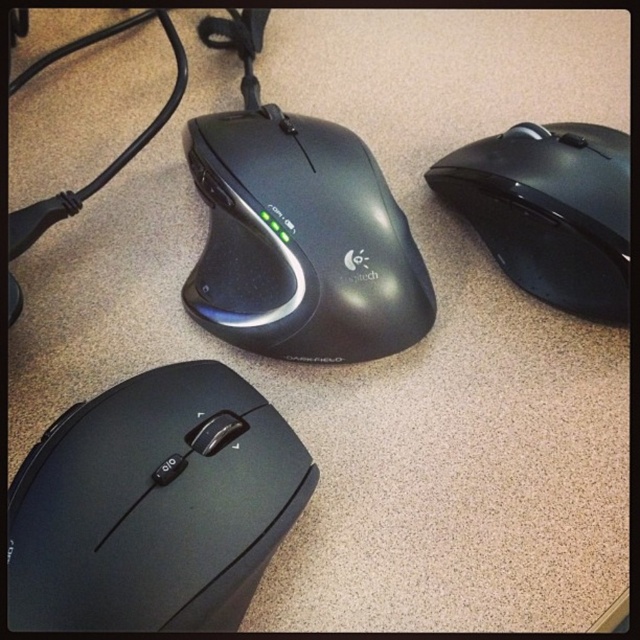
Does black matte mouse at center appear on the right side of black glossy mouse at upper right?

In fact, black matte mouse at center is to the left of black glossy mouse at upper right.

The width and height of the screenshot is (640, 640). I want to click on black matte mouse at center, so click(301, 241).

This screenshot has height=640, width=640. What are the coordinates of `black matte mouse at center` in the screenshot? It's located at (301, 241).

Locate an element on the screen. black matte mouse at center is located at coordinates (x=301, y=241).

Can you confirm if black matte/black textured mouse at lower left is positioned below black glossy mouse at upper right?

Correct, black matte/black textured mouse at lower left is located below black glossy mouse at upper right.

Is black matte/black textured mouse at lower left wider than black glossy mouse at upper right?

Correct, the width of black matte/black textured mouse at lower left exceeds that of black glossy mouse at upper right.

Is point (102, 410) in front of point (474, 227)?

That is True.

Image resolution: width=640 pixels, height=640 pixels. Find the location of `black matte/black textured mouse at lower left`. black matte/black textured mouse at lower left is located at coordinates (154, 506).

Who is taller, black matte/black textured mouse at lower left or black matte mouse at center?

Standing taller between the two is black matte mouse at center.

Is black matte/black textured mouse at lower left closer to the viewer compared to black matte mouse at center?

Yes, it is.

At what (x,y) coordinates should I click in order to perform the action: click on black matte/black textured mouse at lower left. Please return your answer as a coordinate pair (x, y). Looking at the image, I should click on (154, 506).